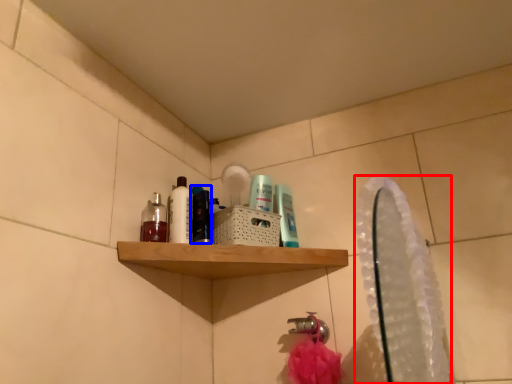
Question: Which of the following is the closest to the observer, mirror (highlighted by a red box) or mouthwash (highlighted by a blue box)?

Choices:
 (A) mirror
 (B) mouthwash

Answer: (A)